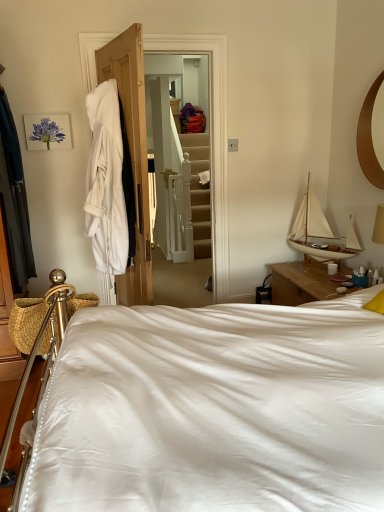
Question: Does point (221, 116) appear closer or farther from the camera than point (337, 266)?

Choices:
 (A) closer
 (B) farther

Answer: (A)

Question: Based on their sizes in the image, would you say white cloth at left is bigger or smaller than white ceramic mug at upper right?

Choices:
 (A) small
 (B) big

Answer: (B)

Question: Which object is positioned farthest from the matte purple flower at upper left?

Choices:
 (A) dark blue fabric at left, the 1th clothing viewed from the left
 (B) white cotton bathrobe at left, the 1th clothing positioned from the right
 (C) white satin bed at center
 (D) white wood sailboat at upper right
 (E) white cloth at left

Answer: (D)

Question: Which object is the farthest from the white cloth at left?

Choices:
 (A) white satin bed at center
 (B) wooden mirror at upper right
 (C) white cotton bathrobe at left, the 1th clothing positioned from the right
 (D) white ceramic mug at upper right
 (E) matte purple flower at upper left

Answer: (D)